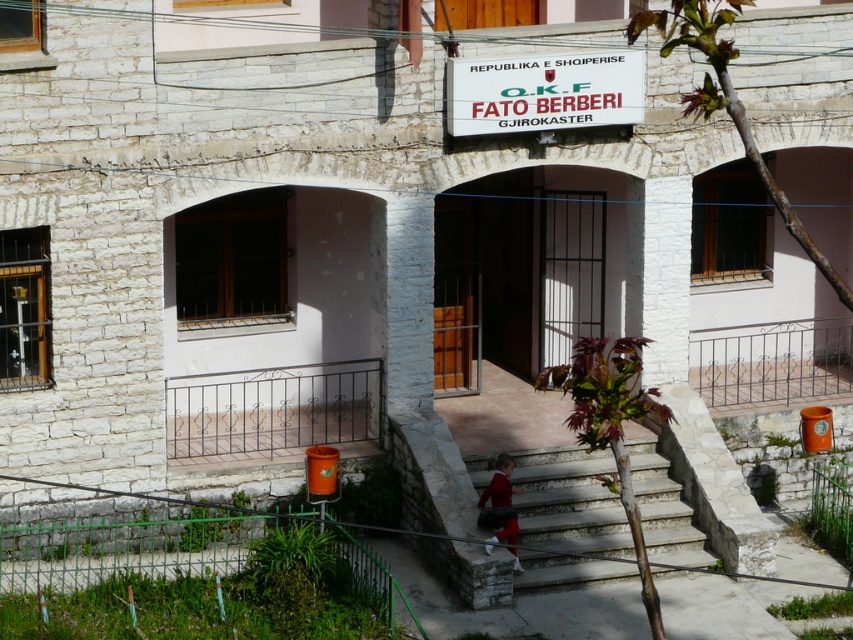
Is white stone stairs at center to the left of white plastic sign at upper center from the viewer's perspective?

Incorrect, white stone stairs at center is not on the left side of white plastic sign at upper center.

Is white stone stairs at center behind white plastic sign at upper center?

No, white stone stairs at center is in front of white plastic sign at upper center.

Between point (560, 464) and point (537, 106), which one is positioned behind?

The point (560, 464) is more distant.

This screenshot has width=853, height=640. I want to click on white stone stairs at center, so pyautogui.click(x=567, y=518).